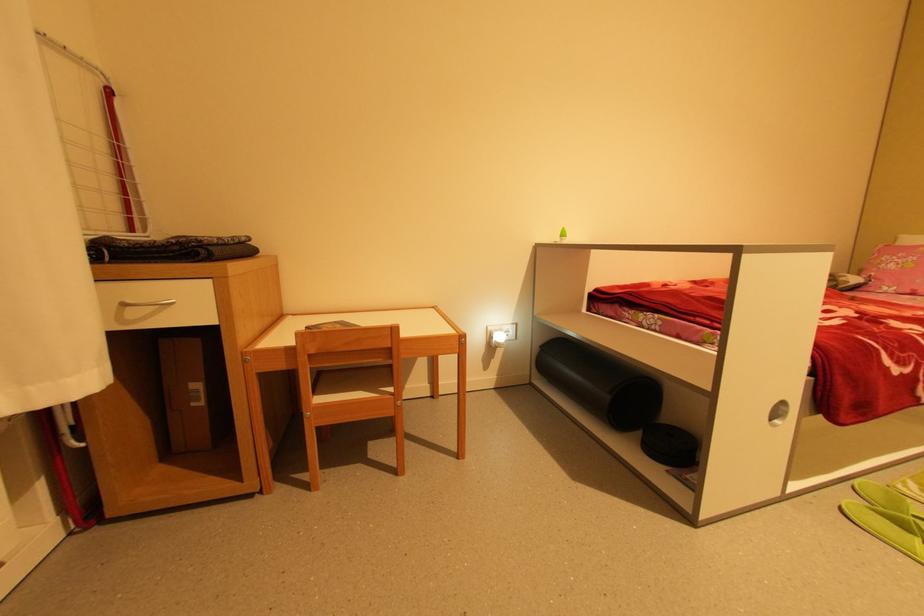
This screenshot has width=924, height=616. Find the location of `chair sitting surface`. chair sitting surface is located at coordinates point(351,385).